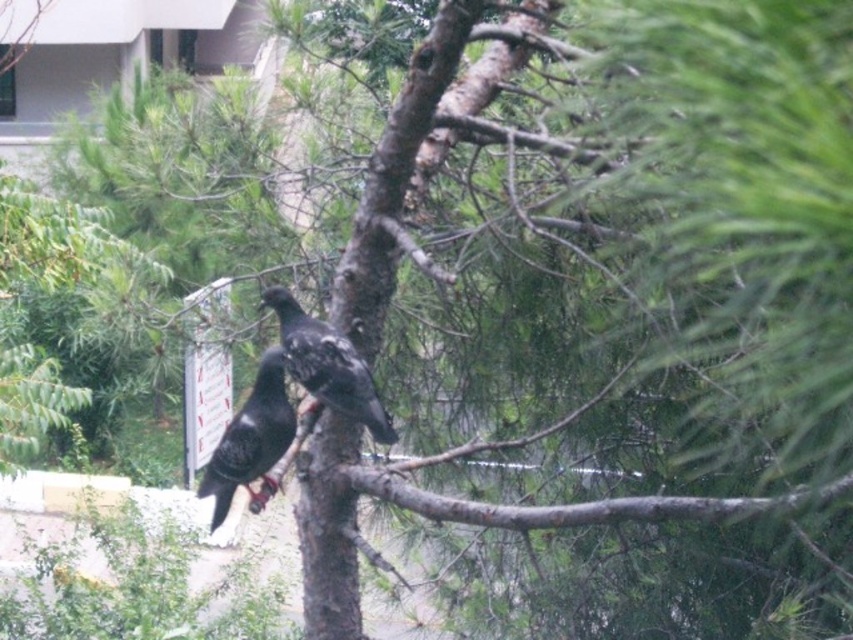
You are a birdwatcher standing 2 meters away from the brown rough tree branch at center. You want to observe the shiny black pigeon at center through your telescope. Can you see the pigeon clearly if your telescope has a minimum focusing distance of 1.5 meters?

The distance between the brown rough tree branch at center and the shiny black pigeon at center is 1.01 meters. Since you are 2 meters away from the branch, the pigeon would be approximately 2 meters plus 1.01 meters away from you, totaling 3.01 meters. This is beyond the telescope minimum focusing distance of 1.5 meters, so yes, you can see the pigeon clearly.